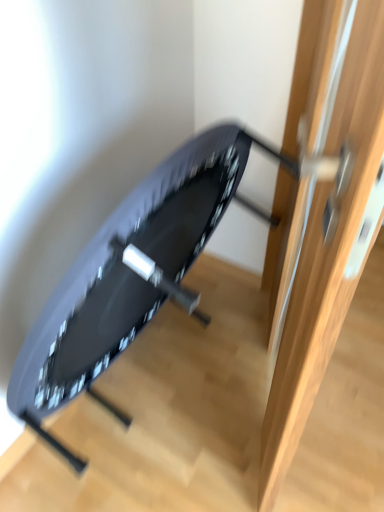
Where is `free location to the right of wooden door at center`? The image size is (384, 512). free location to the right of wooden door at center is located at coordinates (348, 392).